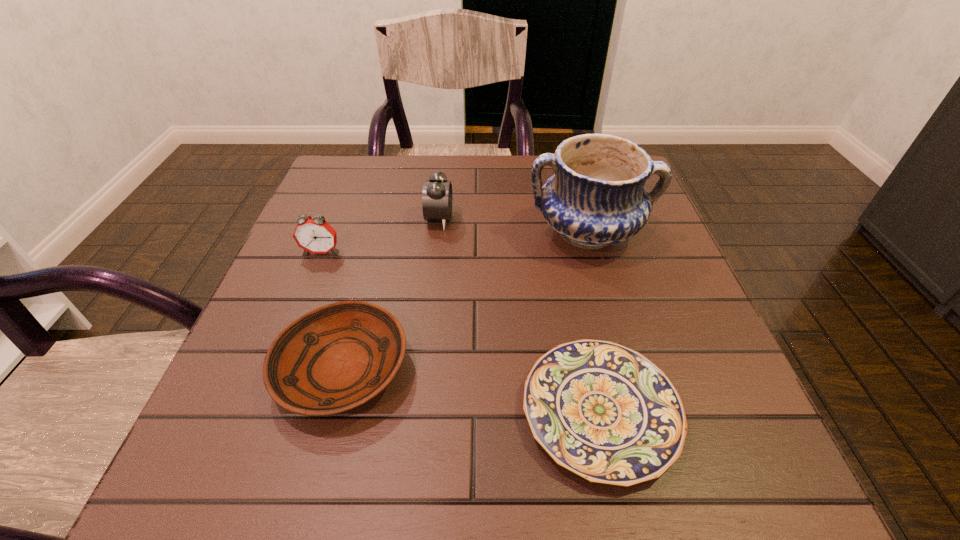
The image size is (960, 540). What are the coordinates of `vacant position in the image that satisfies the following two spatial constraints: 1. on the back side of the left plate; 2. on the left side of the pottery` in the screenshot? It's located at (378, 233).

Image resolution: width=960 pixels, height=540 pixels. In order to click on vacant space that satisfies the following two spatial constraints: 1. on the front side of the right alarm clock; 2. on the clock face of the nearer alarm clock in this screenshot , I will do `click(436, 252)`.

The image size is (960, 540). Identify the location of free space that satisfies the following two spatial constraints: 1. on the back side of the pottery; 2. on the front side of the right alarm clock. coord(584,219).